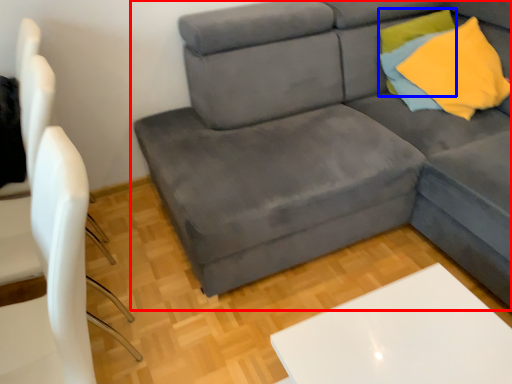
Question: Among these objects, which one is nearest to the camera, studio couch (highlighted by a red box) or pillow (highlighted by a blue box)?

Choices:
 (A) studio couch
 (B) pillow

Answer: (A)